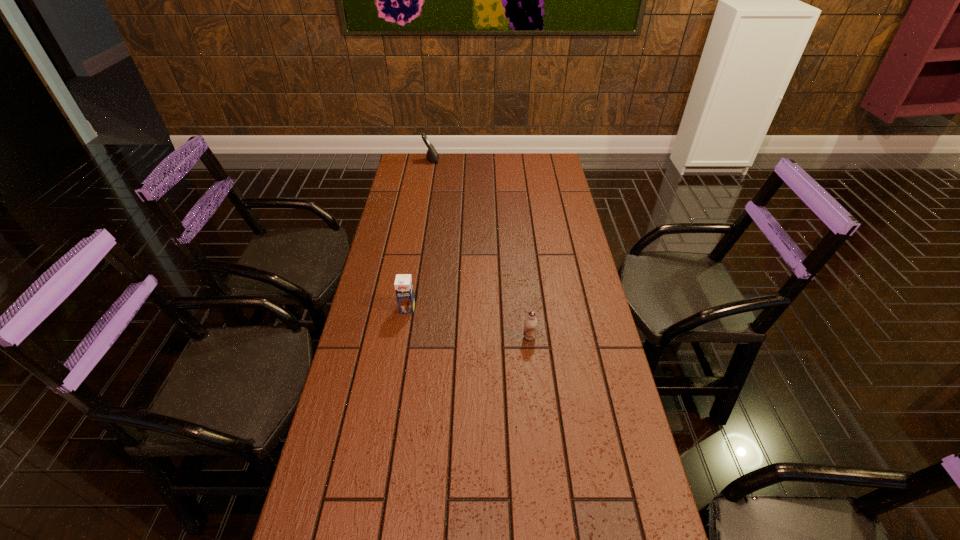
The image size is (960, 540). I want to click on chocolate milk situated at the left edge, so [403, 284].

Find the location of a particular element. The width and height of the screenshot is (960, 540). object present at the far left corner is located at coordinates (432, 155).

Locate an element on the screen. This screenshot has width=960, height=540. free space at the far edge of the desktop is located at coordinates (448, 170).

You are a GUI agent. You are given a task and a screenshot of the screen. Output one action in this format:
    pyautogui.click(x=<x>, y=<y>)
    Task: Click on the free location at the left edge
    This screenshot has height=540, width=960.
    Given the screenshot: What is the action you would take?
    pyautogui.click(x=405, y=323)

In order to click on blank space at the right edge of the desktop in this screenshot , I will do `click(569, 229)`.

Identify the location of free space at the far right corner of the desktop. The height and width of the screenshot is (540, 960). (543, 170).

This screenshot has width=960, height=540. What are the coordinates of `free space that is in between the rightmost object and the farther chocolate milk` in the screenshot? It's located at (468, 323).

The height and width of the screenshot is (540, 960). I want to click on free area in between the taller chocolate milk and the farthest object, so click(x=420, y=234).

The height and width of the screenshot is (540, 960). What are the coordinates of `unoccupied area between the right chocolate milk and the taller chocolate milk` in the screenshot? It's located at (468, 323).

This screenshot has width=960, height=540. I want to click on vacant region between the shortest object and the farthest object, so click(x=480, y=249).